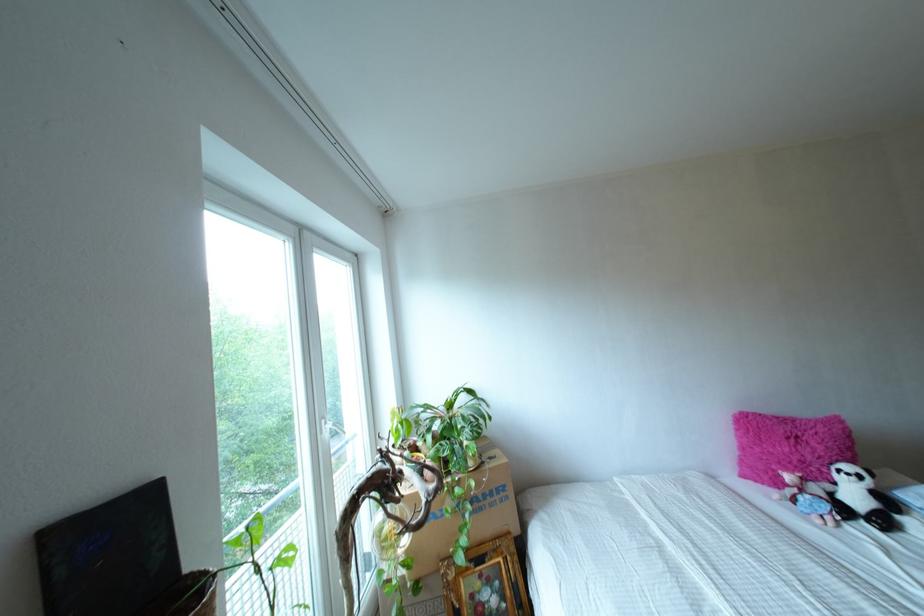
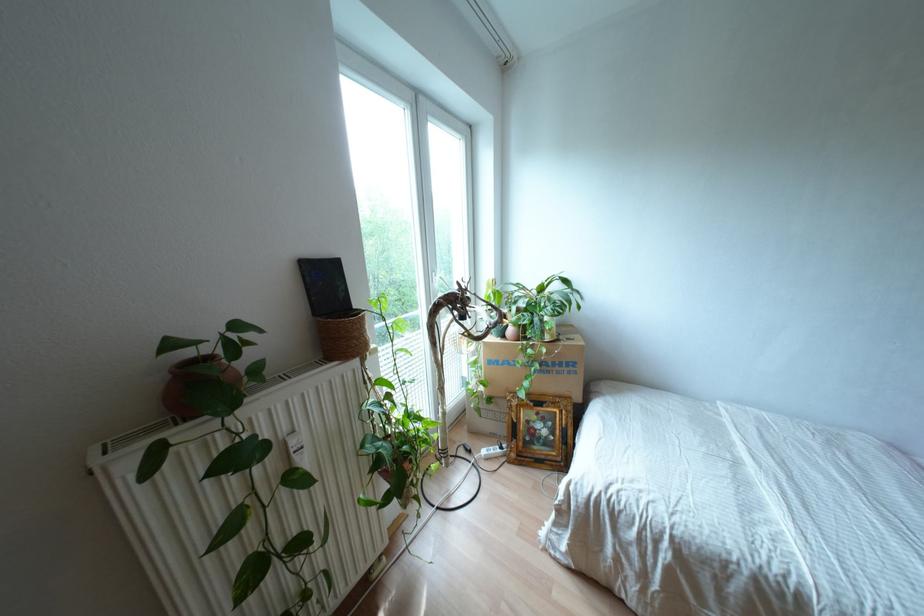
The point at [490,493] is marked in the first image. Where is the corresponding point in the second image?

(560, 363)